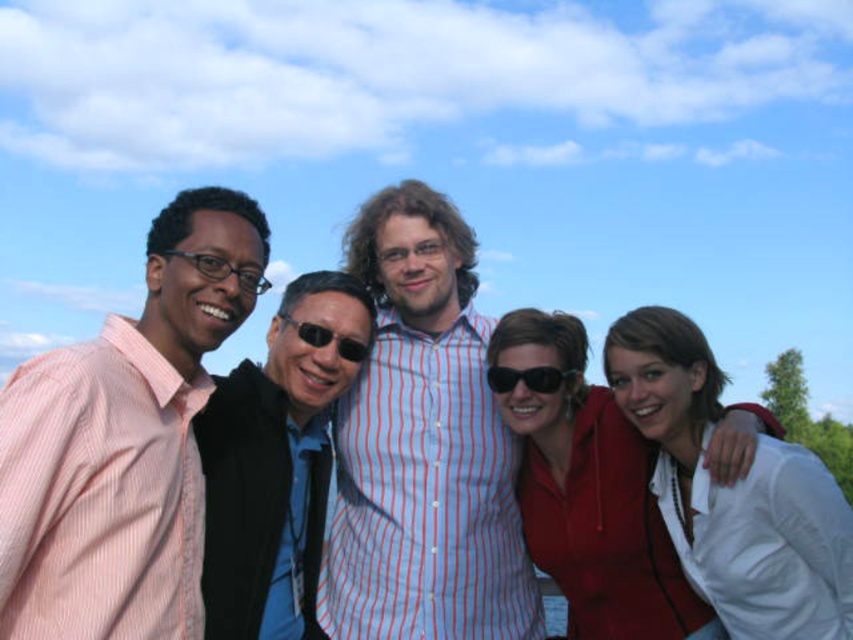
Is white matte jacket at center bigger than black plastic sunglasses at center?

Correct, white matte jacket at center is larger in size than black plastic sunglasses at center.

Who is more distant from viewer, (790, 577) or (498, 365)?

Point (498, 365)

Is point (767, 492) in front of point (552, 380)?

Yes, it is in front of point (552, 380).

At what (x,y) coordinates should I click in order to perform the action: click on white matte jacket at center. Please return your answer as a coordinate pair (x, y). Looking at the image, I should click on (733, 492).

Between pink striped shirt at left and black plastic sunglasses at center, which one has less height?

Standing shorter between the two is black plastic sunglasses at center.

Does pink striped shirt at left appear over black plastic sunglasses at center?

No, pink striped shirt at left is not above black plastic sunglasses at center.

Where is `pink striped shirt at left`? The width and height of the screenshot is (853, 640). pink striped shirt at left is located at coordinates (120, 445).

In order to click on pink striped shirt at left in this screenshot , I will do (120, 445).

Does point (773, 544) come in front of point (368, 346)?

Yes, it is in front of point (368, 346).

Is point (614, 339) farther from viewer compared to point (347, 346)?

No.

You are a GUI agent. You are given a task and a screenshot of the screen. Output one action in this format:
    pyautogui.click(x=<x>, y=<y>)
    Task: Click on the white matte jacket at center
    The image size is (853, 640).
    Given the screenshot: What is the action you would take?
    pyautogui.click(x=733, y=492)